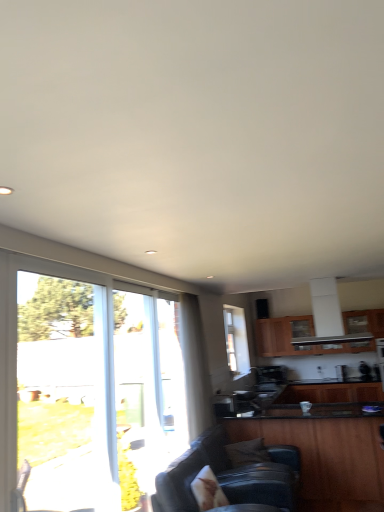
Question: Is wooden cabinet at upper center, the first cabinetry viewed from the back, bigger than clear glass window at left, placed as the 2th window when sorted from right to left?

Choices:
 (A) no
 (B) yes

Answer: (B)

Question: From the image's perspective, does wooden cabinet at upper center, the first cabinetry viewed from the back, appear higher than clear glass window at left, the first window viewed from the left?

Choices:
 (A) no
 (B) yes

Answer: (A)

Question: Can you confirm if wooden cabinet at upper center, the first cabinetry viewed from the back, is shorter than clear glass window at left, the first window viewed from the left?

Choices:
 (A) yes
 (B) no

Answer: (A)

Question: Is wooden cabinet at upper center, the first cabinetry viewed from the back, smaller than clear glass window at left, which appears as the second window when viewed from the back?

Choices:
 (A) yes
 (B) no

Answer: (B)

Question: Does wooden cabinet at upper center, which is the third cabinetry from front to back, contain clear glass window at left, acting as the 1th window starting from the front?

Choices:
 (A) no
 (B) yes

Answer: (A)

Question: Is wooden cabinet at upper center, the first cabinetry viewed from the back, turned away from clear glass window at left, the first window viewed from the left?

Choices:
 (A) yes
 (B) no

Answer: (B)

Question: Considering the relative sizes of wooden cabinet at lower right, which ranks as the third cabinetry in back-to-front order, and wooden cabinet at upper center, the first cabinetry viewed from the back, in the image provided, is wooden cabinet at lower right, which ranks as the third cabinetry in back-to-front order, smaller than wooden cabinet at upper center, the first cabinetry viewed from the back,?

Choices:
 (A) no
 (B) yes

Answer: (A)

Question: Is wooden cabinet at lower right, which ranks as the third cabinetry in back-to-front order, outside wooden cabinet at upper center, the first cabinetry viewed from the back?

Choices:
 (A) yes
 (B) no

Answer: (A)

Question: Is the surface of wooden cabinet at lower right, marked as the 1th cabinetry in a front-to-back arrangement, in direct contact with wooden cabinet at upper center, which is the third cabinetry from front to back?

Choices:
 (A) yes
 (B) no

Answer: (B)

Question: Considering the relative sizes of wooden cabinet at lower right, marked as the 1th cabinetry in a front-to-back arrangement, and wooden cabinet at upper center, the first cabinetry viewed from the back, in the image provided, is wooden cabinet at lower right, marked as the 1th cabinetry in a front-to-back arrangement, thinner than wooden cabinet at upper center, the first cabinetry viewed from the back,?

Choices:
 (A) no
 (B) yes

Answer: (A)

Question: From the image's perspective, is wooden cabinet at lower right, which ranks as the third cabinetry in back-to-front order, located beneath wooden cabinet at upper center, which is the third cabinetry from front to back?

Choices:
 (A) no
 (B) yes

Answer: (B)

Question: Is wooden cabinet at upper center, the first cabinetry viewed from the back, located within wooden cabinet at lower right, marked as the 1th cabinetry in a front-to-back arrangement?

Choices:
 (A) no
 (B) yes

Answer: (A)

Question: Is clear glass window at left, acting as the 1th window starting from the front, shorter than wooden cabinet at upper center, which is the third cabinetry from front to back?

Choices:
 (A) yes
 (B) no

Answer: (B)